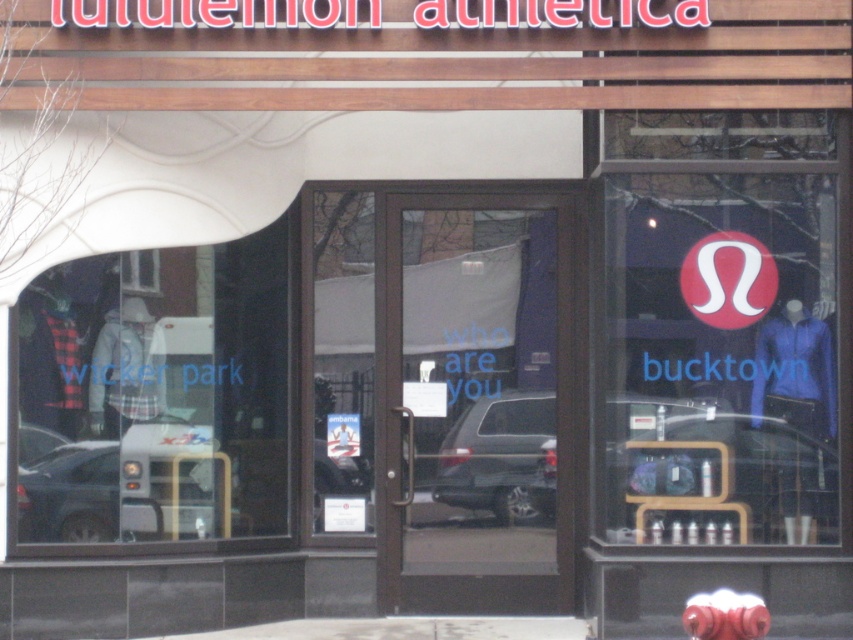
You are standing in front of the Lululemon Athletina store and want to take a photo of the store with the metallic silver bus at lower left in the background. Is the bus at a distance that can be captured in the photo?

The metallic silver bus at lower left is 33.78 feet away from the camera, so it can be captured in the photo as it is within a reasonable distance for a background element.

You are standing outside the Lululemon Athletica store and see the point marked at coordinate (120, 486). What object is located at that point?

The point at coordinate (120, 486) marks the location of the metallic silver bus at lower left.

You are a delivery person needing to park your vehicle in the parking lot adjacent to the Lululemon store. The parking spot you found is 5 meters long. Which vehicle, the metallic silver bus at lower left or the satin silver suv at center, would fit better in this space?

The satin silver suv at center would fit better in the 5 meter parking spot since it is smaller than the metallic silver bus at lower left.